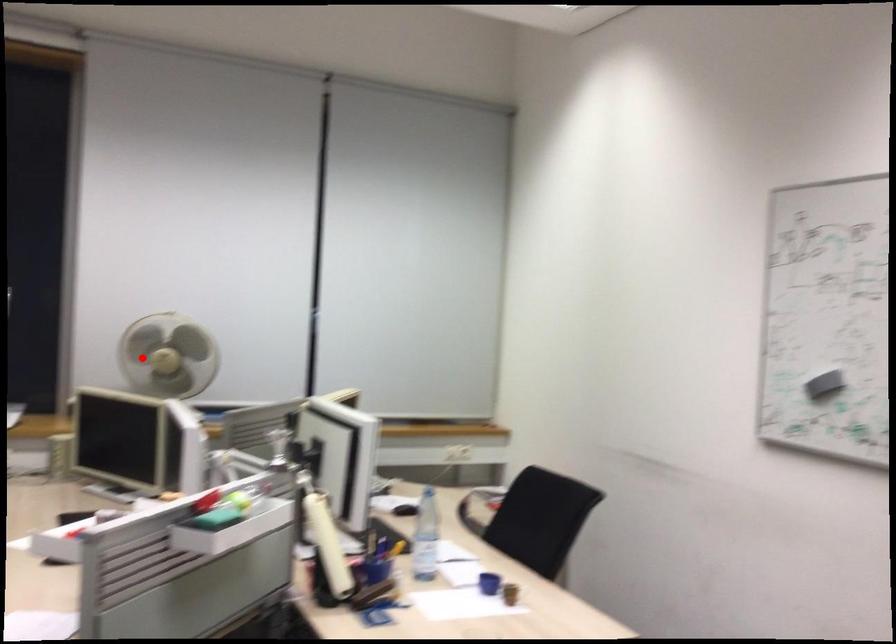
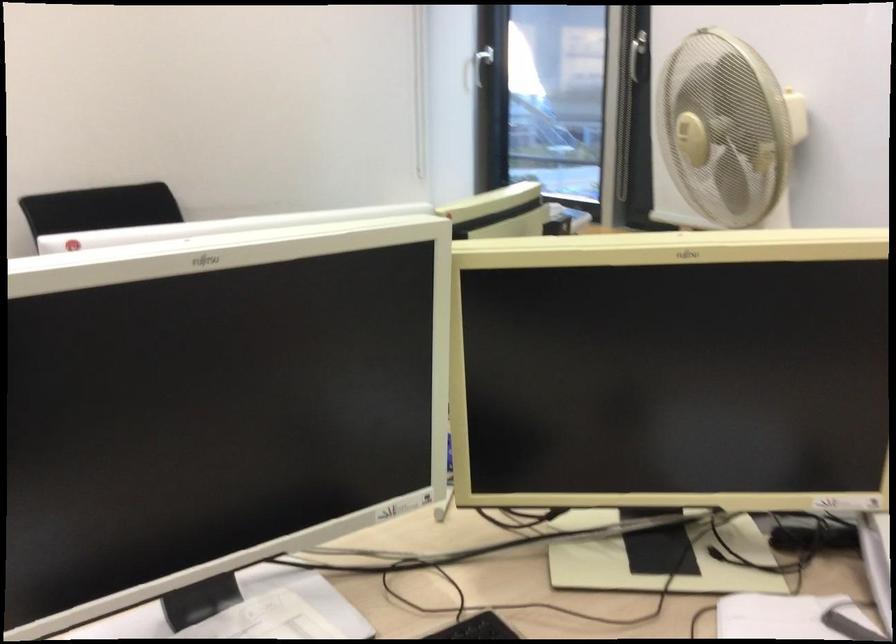
Question: I am providing you with two images of the same scene from different viewpoints. A red point is marked on the first image. Can you still see the location of the red point in image 2?

Choices:
 (A) Yes
 (B) No

Answer: (A)